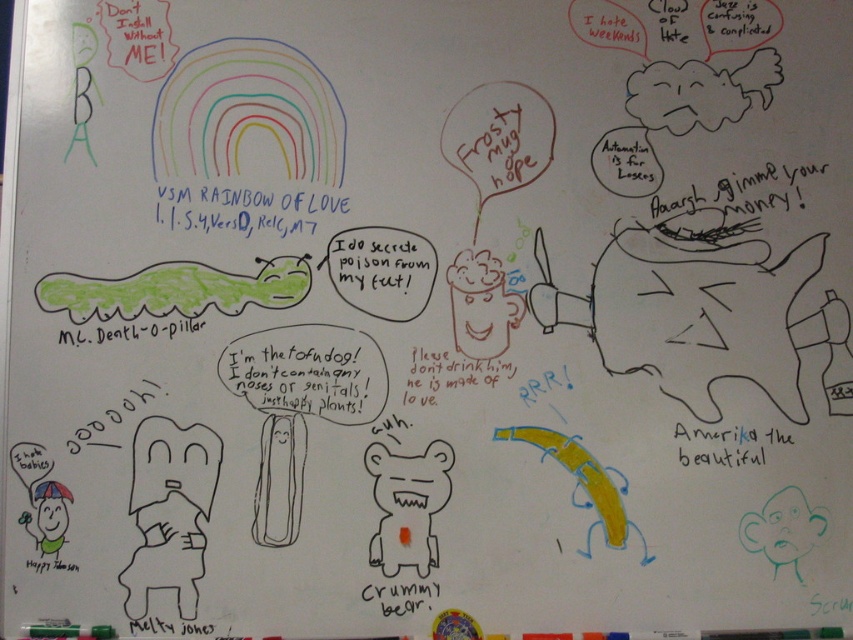
Question: Which point appears farthest from the camera in this image?

Choices:
 (A) (709, 440)
 (B) (173, 227)

Answer: (A)

Question: Does black marker text at upper center lie in front of black paper at lower right?

Choices:
 (A) yes
 (B) no

Answer: (A)

Question: Does black marker text at upper center appear on the left side of black paper at lower right?

Choices:
 (A) yes
 (B) no

Answer: (A)

Question: Is black marker text at upper center bigger than black paper at lower right?

Choices:
 (A) yes
 (B) no

Answer: (A)

Question: Which of the following is the farthest from the observer?

Choices:
 (A) black marker text at upper center
 (B) black paper at lower right

Answer: (B)